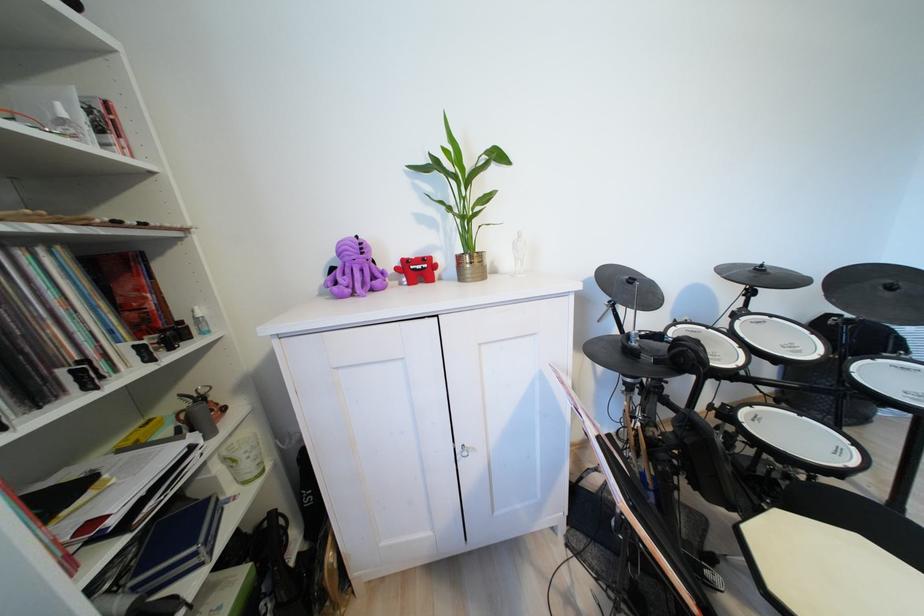
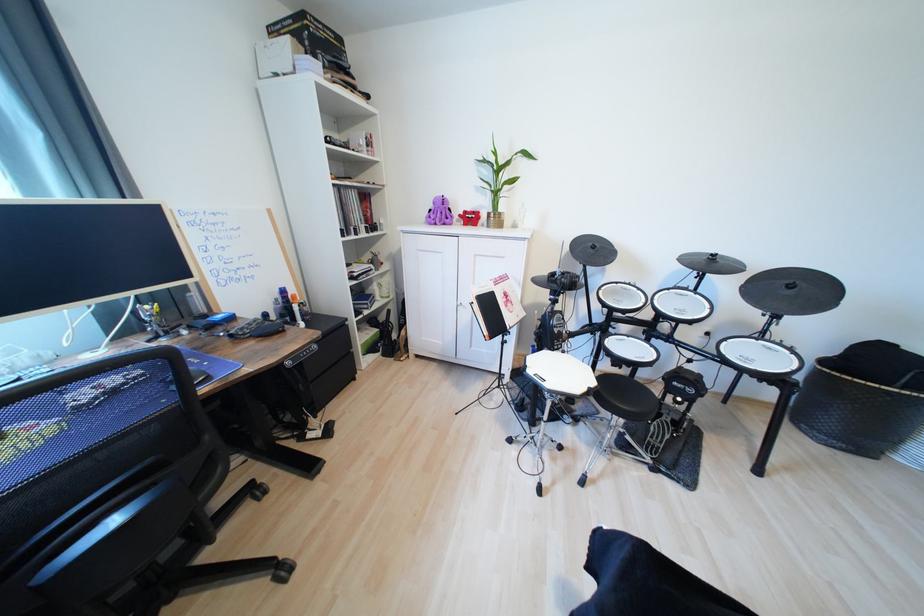
The point at (769, 267) is marked in the first image. Where is the corresponding point in the second image?

(721, 257)